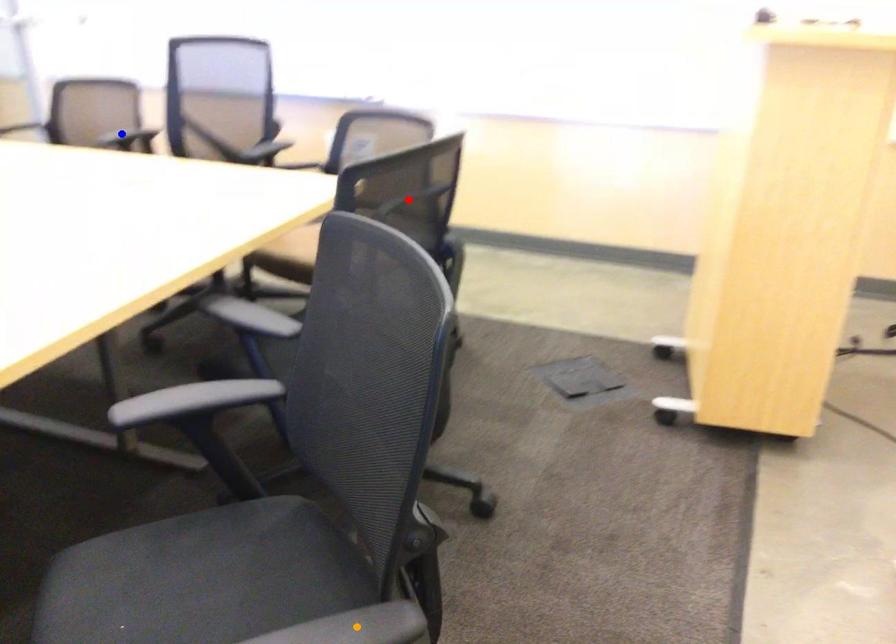
Order these from nearest to farthest:
blue point, red point, orange point

blue point < red point < orange point